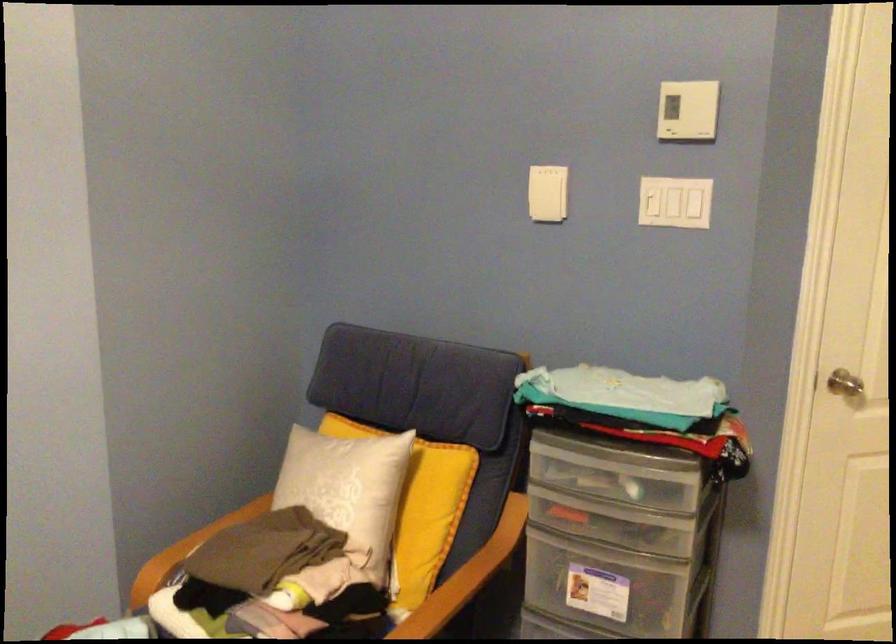
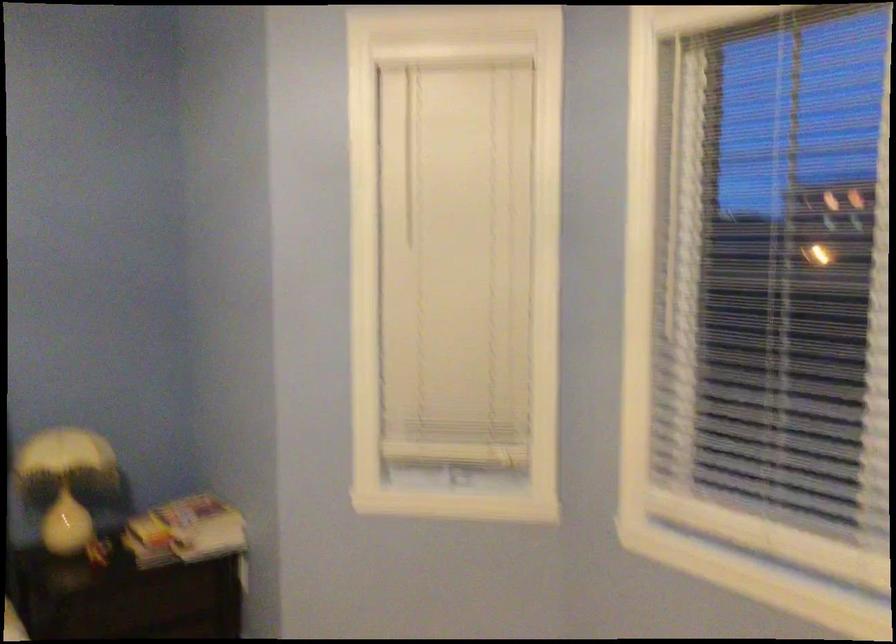
Question: The images are taken continuously from a first-person perspective. In which direction is your viewpoint rotating?

Choices:
 (A) Left
 (B) Right
 (C) Up
 (D) Down

Answer: (A)